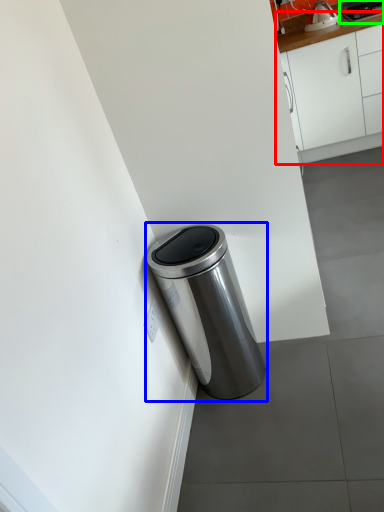
Question: Which object is positioned closest to cabinetry (highlighted by a red box)? Select from waste container (highlighted by a blue box) and appliance (highlighted by a green box).

Choices:
 (A) waste container
 (B) appliance

Answer: (B)